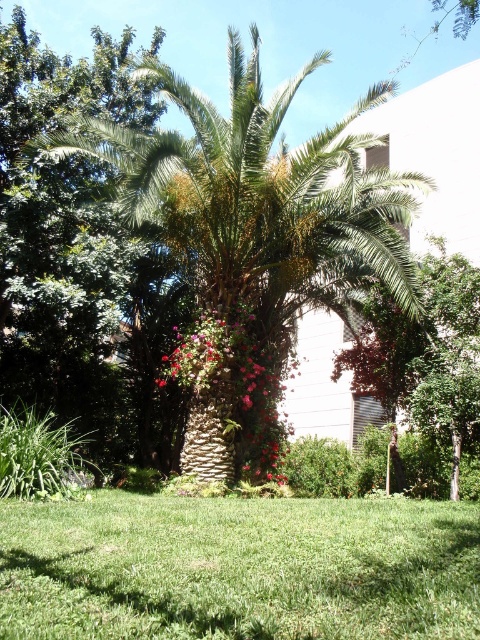
You are a gardener planning to plant a new bush between the green leafy tree at center and the pink textured flowers at center. Based on their current positions, which direction should you plant the bush relative to the flowers?

The green leafy tree at center is positioned on the right side of pink textured flowers at center, so you should plant the bush to the left of the pink textured flowers at center to place it between them.

You are a gardener planning to install a sprinkler system between the green textured palm tree at center and the green leafy tree at center. The sprinkler requires a minimum of 2 meters of space to function properly. Based on the scene, will the available space between the two trees be sufficient for the sprinkler system?

The distance between the green textured palm tree at center and the green leafy tree at center is 2.22 meters, which exceeds the required 2 meters. Therefore, the sprinkler system will have sufficient space to function properly.

You are a gardener planning to plant a new shrub in the garden. You want to place it so that it will receive enough sunlight but also be shaded by the green leafy tree at center during the hottest part of the day. Where should you position the shrub relative to the pink textured flowers at center?

The green leafy tree at center is located above the pink textured flowers at center, so positioning the shrub near the pink textured flowers at center would place it under the tree, providing shade during the hottest part of the day while still allowing sunlight to reach it from above.